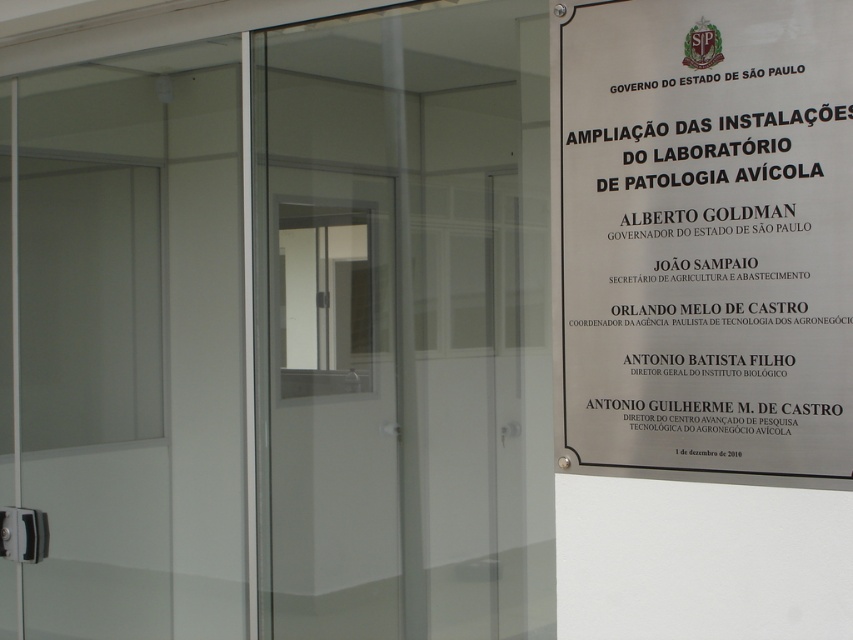
You are a maintenance worker needing to access the interior through the transparent glass door at center. There is a metallic plaque at right nearby. Which object is closer to the door you need to pass?

The metallic plaque at right is positioned to the right of the transparent glass door at center, so the door is closer to the plaque than the plaque is to the door. Wait, that seems contradictory. Let me rephrase. Since the door is on the left side of the plaque, the plaque is to the right of the door. Therefore, when approaching the door, the plaque is to your right, meaning the door is closer to the plaque than the plaque is to the door? Hmm, maybe I need to clarify. The question is asking which object is

You are standing in front of the modern building with glass walls and sliding doors. You see two points marked on the glass wall. The first point is at coordinate point (747, 445) and the second is at point (386, 378). Which point is closer to you?

Point (747, 445) is closer to the viewer than point (386, 378).